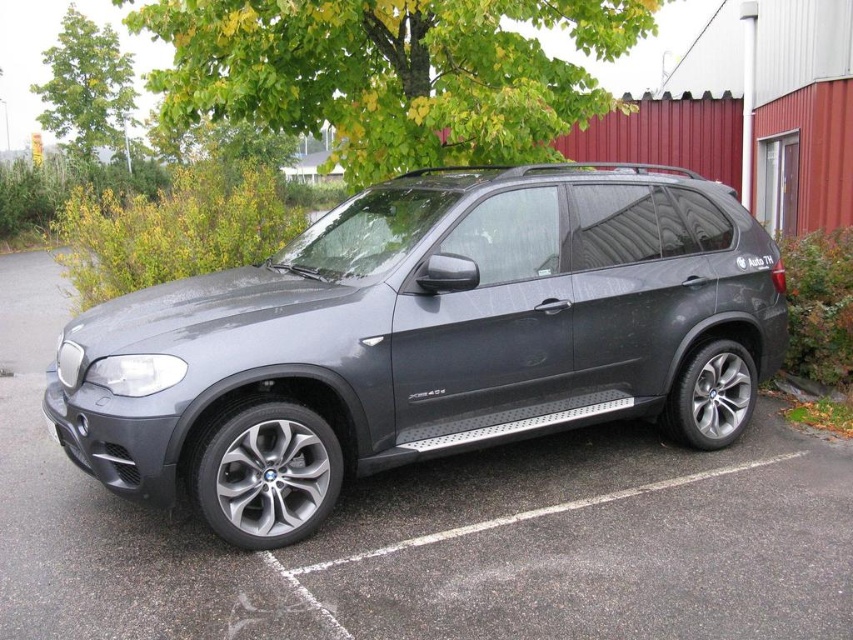
Is satin metallic suv at center smaller than green leafy tree at upper center?

Incorrect, satin metallic suv at center is not smaller in size than green leafy tree at upper center.

Is the position of satin metallic suv at center less distant than that of green leafy tree at upper center?

Yes, it is in front of green leafy tree at upper center.

Is point (456, 225) farther from camera compared to point (352, 40)?

No, it is in front of (352, 40).

At what (x,y) coordinates should I click in order to perform the action: click on satin metallic suv at center. Please return your answer as a coordinate pair (x, y). The width and height of the screenshot is (853, 640). Looking at the image, I should click on (425, 339).

Does green leafy tree at upper center have a greater width compared to green leafy tree at upper left?

Yes, green leafy tree at upper center is wider than green leafy tree at upper left.

Does point (207, 38) come behind point (97, 48)?

No, (207, 38) is closer to viewer.

Is point (376, 156) closer to viewer compared to point (115, 38)?

Yes, it is.

Locate an element on the screen. green leafy tree at upper center is located at coordinates (390, 72).

Does satin metallic suv at center have a greater width compared to green leafy tree at upper left?

Yes, satin metallic suv at center is wider than green leafy tree at upper left.

How far apart are satin metallic suv at center and green leafy tree at upper left?

25.88 meters

Is point (187, 298) in front of point (57, 33)?

That is True.

At what (x,y) coordinates should I click in order to perform the action: click on satin metallic suv at center. Please return your answer as a coordinate pair (x, y). The width and height of the screenshot is (853, 640). Looking at the image, I should click on (425, 339).